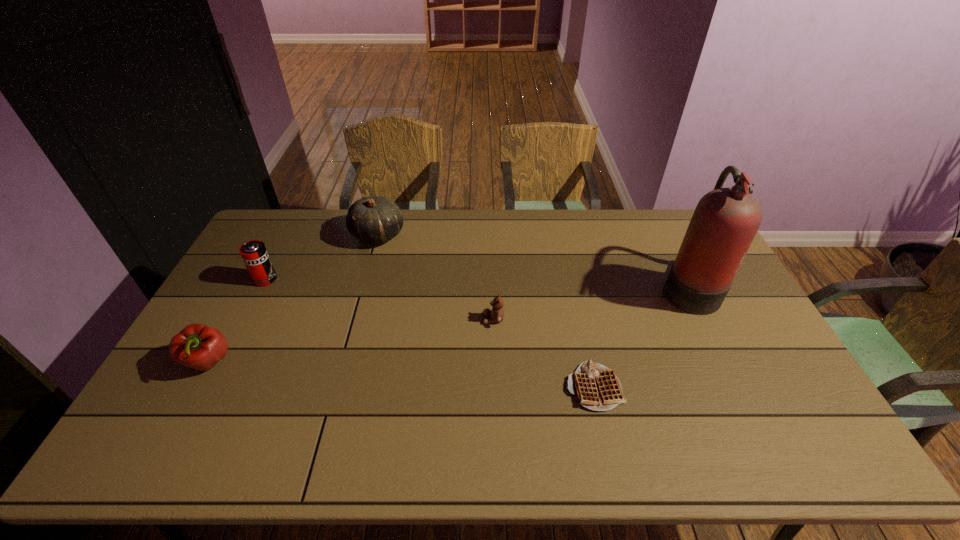
The height and width of the screenshot is (540, 960). I want to click on object at the far edge, so click(373, 219).

Find the location of a particular element. The width and height of the screenshot is (960, 540). can at the left edge is located at coordinates (254, 253).

Locate an element on the screen. bell pepper present at the left edge is located at coordinates (197, 346).

This screenshot has width=960, height=540. I want to click on object at the right edge, so click(726, 220).

Locate an element on the screen. This screenshot has width=960, height=540. free spot at the far edge of the desktop is located at coordinates (618, 214).

Find the location of a particular element. Image resolution: width=960 pixels, height=540 pixels. vacant space at the near edge of the desktop is located at coordinates (740, 433).

You are a GUI agent. You are given a task and a screenshot of the screen. Output one action in this format:
    pyautogui.click(x=<x>, y=<y>)
    Task: Click on the vacant space at the left edge of the desktop
    This screenshot has width=960, height=540.
    Given the screenshot: What is the action you would take?
    pyautogui.click(x=209, y=419)

In the image, there is a desktop. Where is `vacant space at the right edge`? The height and width of the screenshot is (540, 960). vacant space at the right edge is located at coordinates (751, 374).

Where is `vacant space at the near left corner of the desktop`? This screenshot has height=540, width=960. vacant space at the near left corner of the desktop is located at coordinates (172, 433).

In order to click on vacant space at the far right corner of the desktop in this screenshot , I will do `click(684, 217)`.